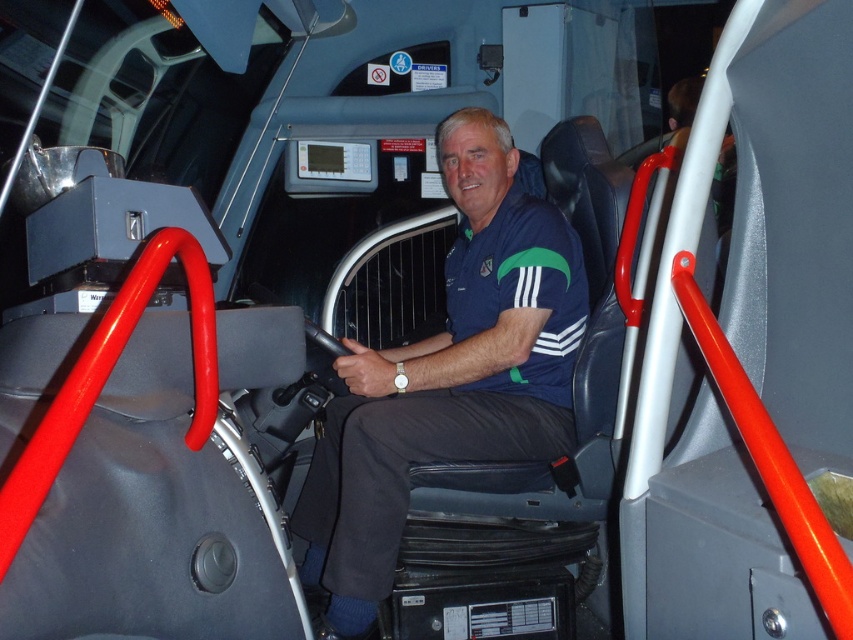
Question: Can you confirm if blue fabric shirt at center is smaller than blue fabric polo shirt at center?

Choices:
 (A) yes
 (B) no

Answer: (B)

Question: Is blue fabric shirt at center behind blue fabric polo shirt at center?

Choices:
 (A) no
 (B) yes

Answer: (A)

Question: Is blue fabric shirt at center below blue fabric polo shirt at center?

Choices:
 (A) no
 (B) yes

Answer: (B)